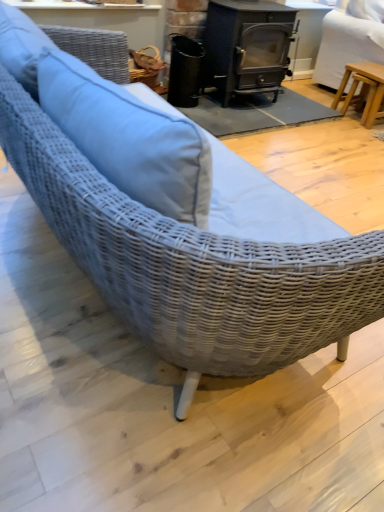
Question: Does black cast iron wood burning stove at center appear on the right side of black matte trash can at center?

Choices:
 (A) yes
 (B) no

Answer: (A)

Question: Is black cast iron wood burning stove at center next to black matte trash can at center and touching it?

Choices:
 (A) no
 (B) yes

Answer: (A)

Question: From the image's perspective, does black cast iron wood burning stove at center appear lower than black matte trash can at center?

Choices:
 (A) yes
 (B) no

Answer: (B)

Question: From the image's perspective, is black cast iron wood burning stove at center over black matte trash can at center?

Choices:
 (A) no
 (B) yes

Answer: (B)

Question: Is black cast iron wood burning stove at center further to the viewer compared to black matte trash can at center?

Choices:
 (A) yes
 (B) no

Answer: (B)

Question: From a real-world perspective, relative to black matte trash can at center, is light brown wooden stool at right vertically above or below?

Choices:
 (A) below
 (B) above

Answer: (A)

Question: Considering the positions of light brown wooden stool at right and black matte trash can at center in the image, is light brown wooden stool at right taller or shorter than black matte trash can at center?

Choices:
 (A) tall
 (B) short

Answer: (B)

Question: Does point (380, 96) appear closer or farther from the camera than point (195, 60)?

Choices:
 (A) closer
 (B) farther

Answer: (B)

Question: From the image's perspective, is light brown wooden stool at right above or below black matte trash can at center?

Choices:
 (A) below
 (B) above

Answer: (A)

Question: Based on their positions, is light brown wooden stool at right located to the left or right of black cast iron wood burning stove at center?

Choices:
 (A) left
 (B) right

Answer: (B)

Question: Considering the positions of light brown wooden stool at right and black cast iron wood burning stove at center in the image, is light brown wooden stool at right wider or thinner than black cast iron wood burning stove at center?

Choices:
 (A) wide
 (B) thin

Answer: (A)

Question: Considering the positions of point (x=334, y=50) and point (x=205, y=19), is point (x=334, y=50) closer or farther from the camera than point (x=205, y=19)?

Choices:
 (A) farther
 (B) closer

Answer: (A)

Question: Is light brown wooden stool at right bigger or smaller than black cast iron wood burning stove at center?

Choices:
 (A) big
 (B) small

Answer: (A)

Question: Do you think light brown wooden stool at right is within light brown wooden stool at right, or outside of it?

Choices:
 (A) inside
 (B) outside

Answer: (B)

Question: From a real-world perspective, is light brown wooden stool at right physically located above or below light brown wooden stool at right?

Choices:
 (A) above
 (B) below

Answer: (B)